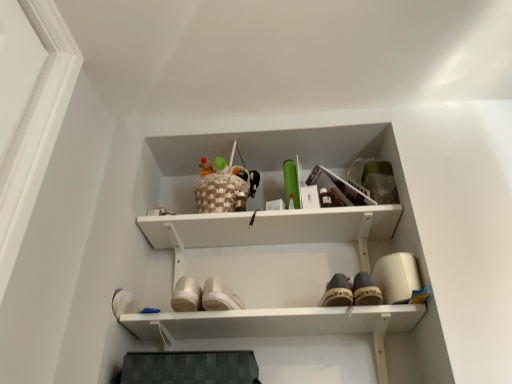
This screenshot has width=512, height=384. Describe the element at coordinates (337, 292) in the screenshot. I see `white canvas shoe at center` at that location.

Find the location of a particular element. white canvas shoe at center is located at coordinates pyautogui.click(x=337, y=292).

The image size is (512, 384). Describe the element at coordinates (226, 187) in the screenshot. I see `woven basket at upper center` at that location.

Identify the location of woven basket at upper center. (226, 187).

What is the approximate height of woven basket at upper center?

It is 25.90 centimeters.

Where is `white canvas shoe at center`? The width and height of the screenshot is (512, 384). white canvas shoe at center is located at coordinates (337, 292).

Which is more to the left, white canvas shoe at center or woven basket at upper center?

woven basket at upper center is more to the left.

Is white canvas shoe at center in front of or behind woven basket at upper center in the image?

Visually, white canvas shoe at center is located in front of woven basket at upper center.

Is point (350, 289) positioned before point (202, 188)?

Yes, point (350, 289) is closer to viewer.

From the image's perspective, is white canvas shoe at center on top of woven basket at upper center?

No, from the image's perspective, white canvas shoe at center is not on top of woven basket at upper center.

From a real-world perspective, who is located higher, white canvas shoe at center or woven basket at upper center?

woven basket at upper center, from a real-world perspective.

Is white canvas shoe at center thinner than woven basket at upper center?

No, white canvas shoe at center is not thinner than woven basket at upper center.

Is white canvas shoe at center shorter than woven basket at upper center?

Correct, white canvas shoe at center is not as tall as woven basket at upper center.

Does white canvas shoe at center have a smaller size compared to woven basket at upper center?

Yes.

Is white canvas shoe at center outside of woven basket at upper center?

white canvas shoe at center is positioned outside woven basket at upper center.

Is white canvas shoe at center with woven basket at upper center?

No, white canvas shoe at center is not making contact with woven basket at upper center.

Does white canvas shoe at center turn towards woven basket at upper center?

No, white canvas shoe at center is not oriented towards woven basket at upper center.

Identify the location of toy to the left of white canvas shoe at center. (226, 187).

In the scene shown: Does woven basket at upper center appear on the right side of white canvas shoe at center?

In fact, woven basket at upper center is to the left of white canvas shoe at center.

Which object is closer to the camera taking this photo, woven basket at upper center or white canvas shoe at center?

white canvas shoe at center is in front.

Is point (206, 204) closer to viewer compared to point (339, 301)?

No, (206, 204) is further to viewer.

From the image's perspective, is woven basket at upper center located above white canvas shoe at center?

Yes, from the image's perspective, woven basket at upper center is on top of white canvas shoe at center.

From a real-world perspective, who is located lower, woven basket at upper center or white canvas shoe at center?

white canvas shoe at center.

Considering the sizes of objects woven basket at upper center and white canvas shoe at center in the image provided, who is thinner, woven basket at upper center or white canvas shoe at center?

woven basket at upper center.

In terms of height, does woven basket at upper center look taller or shorter compared to white canvas shoe at center?

In the image, woven basket at upper center appears to be taller than white canvas shoe at center.

Who is bigger, woven basket at upper center or white canvas shoe at center?

woven basket at upper center is bigger.

Is woven basket at upper center outside of white canvas shoe at center?

Yes, woven basket at upper center is not within white canvas shoe at center.

Does woven basket at upper center touch white canvas shoe at center?

No.

Could you tell me if woven basket at upper center is facing white canvas shoe at center?

No, woven basket at upper center does not turn towards white canvas shoe at center.

What's the angular difference between woven basket at upper center and white canvas shoe at center's facing directions?

2.19 degrees separate the facing orientations of woven basket at upper center and white canvas shoe at center.

I want to click on toy that is behind the white canvas shoe at center, so (226, 187).

The image size is (512, 384). I want to click on toy behind the white canvas shoe at center, so click(226, 187).

Where is `shoe that is on the right side of woven basket at upper center`? Image resolution: width=512 pixels, height=384 pixels. shoe that is on the right side of woven basket at upper center is located at coordinates (337, 292).